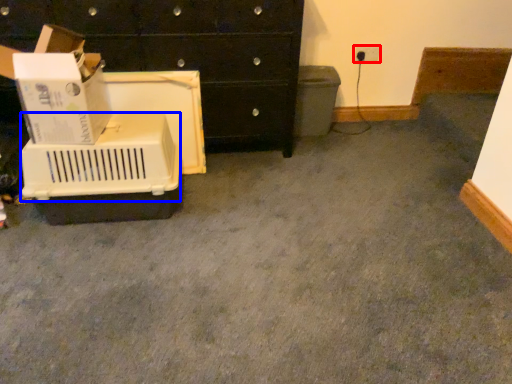
Question: Which object is further to the camera taking this photo, electric outlet (highlighted by a red box) or basket (highlighted by a blue box)?

Choices:
 (A) electric outlet
 (B) basket

Answer: (A)